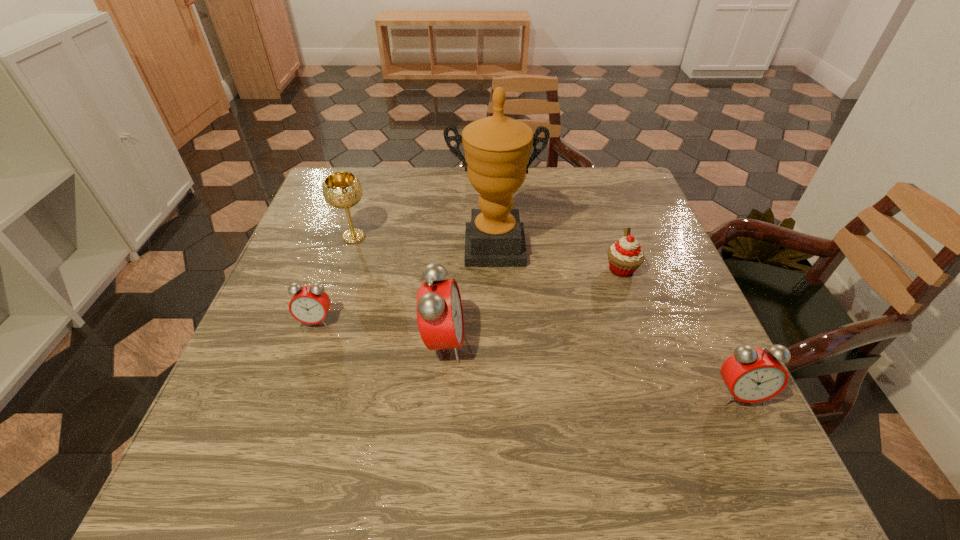
Where is `the shortest alarm clock`? the shortest alarm clock is located at coordinates (309, 304).

Identify the location of the second alarm clock from left to right. (439, 309).

Identify the location of the nearest alarm clock. This screenshot has height=540, width=960. (752, 375).

This screenshot has height=540, width=960. I want to click on the rightmost object, so click(752, 375).

This screenshot has height=540, width=960. What are the coordinates of `award` in the screenshot? It's located at (497, 149).

Where is `cupcake`? cupcake is located at coordinates (625, 256).

Where is `chalice`? chalice is located at coordinates (343, 190).

I want to click on free location located 0.090m on the front-facing side of the leftmost alarm clock, so click(300, 365).

Where is `vacant space located on the front-facing side of the second alarm clock from left to right`? The height and width of the screenshot is (540, 960). vacant space located on the front-facing side of the second alarm clock from left to right is located at coordinates (493, 342).

The image size is (960, 540). Find the location of `vacant region located at the front of the award with handles`. vacant region located at the front of the award with handles is located at coordinates (497, 373).